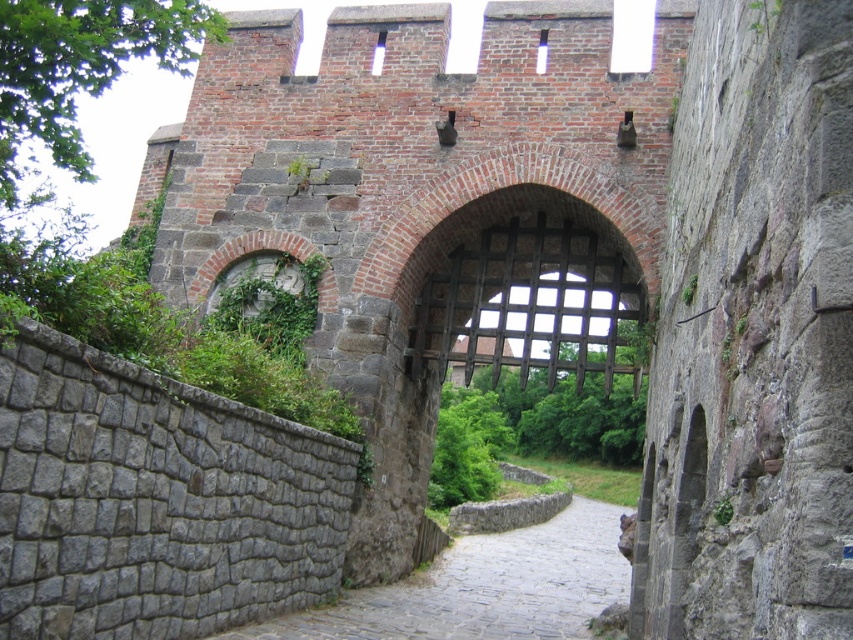
Based on the photo, you are standing in front of the medieval gatehouse and want to determine which of the two points, point (386, 33) or point (538, 44), is closer to you. Based on the scene, can you identify which point is nearer?

Point (386, 33) is closer to you than point (538, 44) because it is further to the viewer in the scene.

You are a knight standing at the entrance of the medieval gatehouse. You need to deliver a message to the lord who is waiting at the transparent glass window at center. The gray cobblestone path at center is the only path available. Given that your horse can trot at a speed of 10 feet per second, how many seconds will it take you to reach the window?

The distance between the gray cobblestone path at center and the transparent glass window at center is 136.57 feet. At a speed of 10 feet per second, it would take approximately 13.66 seconds to reach the window.